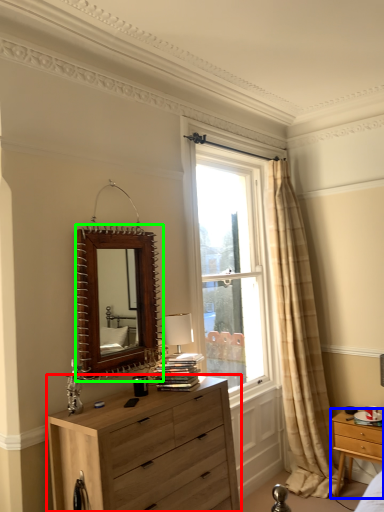
Question: Based on their relative distances, which object is farther from chest of drawers (highlighted by a red box)? Choose from nightstand (highlighted by a blue box) and mirror (highlighted by a green box).

Choices:
 (A) nightstand
 (B) mirror

Answer: (A)